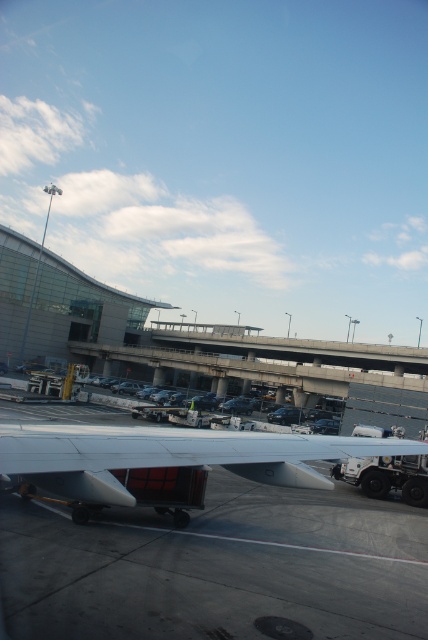
You are a maintenance worker who needs to assess the height difference between the gray concrete tarmac at lower center and the silver metallic wing at center. Based on the scene, which object is taller?

The silver metallic wing at center is taller than the gray concrete tarmac at lower center.

You are a passenger sitting at the window seat of an airplane. You look out and see the gray concrete tarmac at lower center and the silver metallic wing at center. Which object is located to the right side of the other?

The gray concrete tarmac at lower center is positioned on the right side of silver metallic wing at center.